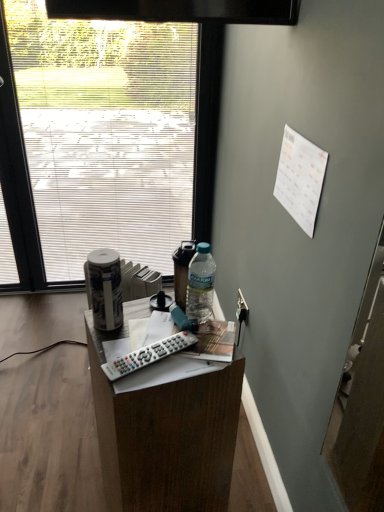
Question: From the image's perspective, relative to wooden desk at center, is black plastic power outlet at lower right above or below?

Choices:
 (A) below
 (B) above

Answer: (B)

Question: Relative to wooden desk at center, is black plastic power outlet at lower right in front or behind?

Choices:
 (A) front
 (B) behind

Answer: (B)

Question: Which is nearer to the frosted glass window at upper left?

Choices:
 (A) white glossy canister at left
 (B) wooden desk at center
 (C) white plastic remote control at center
 (D) black plastic power outlet at lower right

Answer: (D)

Question: Estimate the real-world distances between objects in this image. Which object is closer to the white plastic remote control at center?

Choices:
 (A) white glossy canister at left
 (B) wooden desk at center
 (C) black plastic power outlet at lower right
 (D) frosted glass window at upper left

Answer: (A)